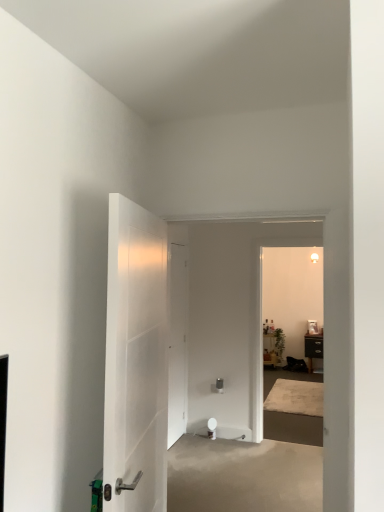
Question: Is beige concrete at center outside of white matte door at center, placed as the 1th door when sorted from back to front?

Choices:
 (A) yes
 (B) no

Answer: (A)

Question: Is white matte door at center, placed as the 1th door when sorted from back to front, a part of beige concrete at center?

Choices:
 (A) no
 (B) yes

Answer: (A)

Question: Can you confirm if beige concrete at center is thinner than white matte door at center, positioned as the 2th door in front-to-back order?

Choices:
 (A) yes
 (B) no

Answer: (B)

Question: Is the depth of beige concrete at center greater than that of white matte door at center, positioned as the 2th door in front-to-back order?

Choices:
 (A) no
 (B) yes

Answer: (A)

Question: Is beige concrete at center to the right of white matte door at center, positioned as the 2th door in front-to-back order, from the viewer's perspective?

Choices:
 (A) yes
 (B) no

Answer: (A)

Question: From their relative heights in the image, would you say beige concrete at center is taller or shorter than wooden side table at center, which is the second furniture in right-to-left order?

Choices:
 (A) tall
 (B) short

Answer: (B)

Question: Relative to wooden side table at center, which ranks as the first furniture in left-to-right order, is beige concrete at center in front or behind?

Choices:
 (A) front
 (B) behind

Answer: (A)

Question: Considering the positions of point (256, 470) and point (271, 360), is point (256, 470) closer or farther from the camera than point (271, 360)?

Choices:
 (A) closer
 (B) farther

Answer: (A)

Question: Based on their sizes in the image, would you say beige concrete at center is bigger or smaller than wooden side table at center, which is the second furniture in right-to-left order?

Choices:
 (A) big
 (B) small

Answer: (A)

Question: Based on their sizes in the image, would you say black matte cabinet at right, the 1th furniture viewed from the right, is bigger or smaller than white matte door at center, placed as the 1th door when sorted from back to front?

Choices:
 (A) big
 (B) small

Answer: (A)

Question: From a real-world perspective, is black matte cabinet at right, the 1th furniture viewed from the right, physically located above or below white matte door at center, placed as the 1th door when sorted from back to front?

Choices:
 (A) above
 (B) below

Answer: (B)

Question: From the image's perspective, relative to white matte door at center, placed as the 1th door when sorted from back to front, is black matte cabinet at right, which is counted as the 2th furniture, starting from the left, above or below?

Choices:
 (A) below
 (B) above

Answer: (A)

Question: Is black matte cabinet at right, which is counted as the 2th furniture, starting from the left, situated inside white matte door at center, placed as the 1th door when sorted from back to front, or outside?

Choices:
 (A) outside
 (B) inside

Answer: (A)

Question: Relative to wooden side table at center, which is the second furniture in right-to-left order, is black matte cabinet at right, the 1th furniture viewed from the right, in front or behind?

Choices:
 (A) front
 (B) behind

Answer: (A)

Question: From the image's perspective, is black matte cabinet at right, the 1th furniture viewed from the right, positioned above or below wooden side table at center, which is the second furniture in right-to-left order?

Choices:
 (A) above
 (B) below

Answer: (A)